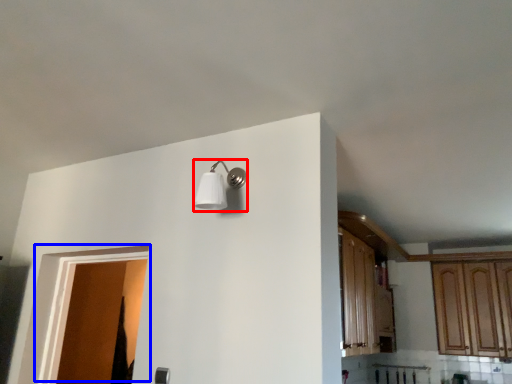
Question: Which of the following is the farthest to the observer, light fixture (highlighted by a red box) or door (highlighted by a blue box)?

Choices:
 (A) light fixture
 (B) door

Answer: (B)